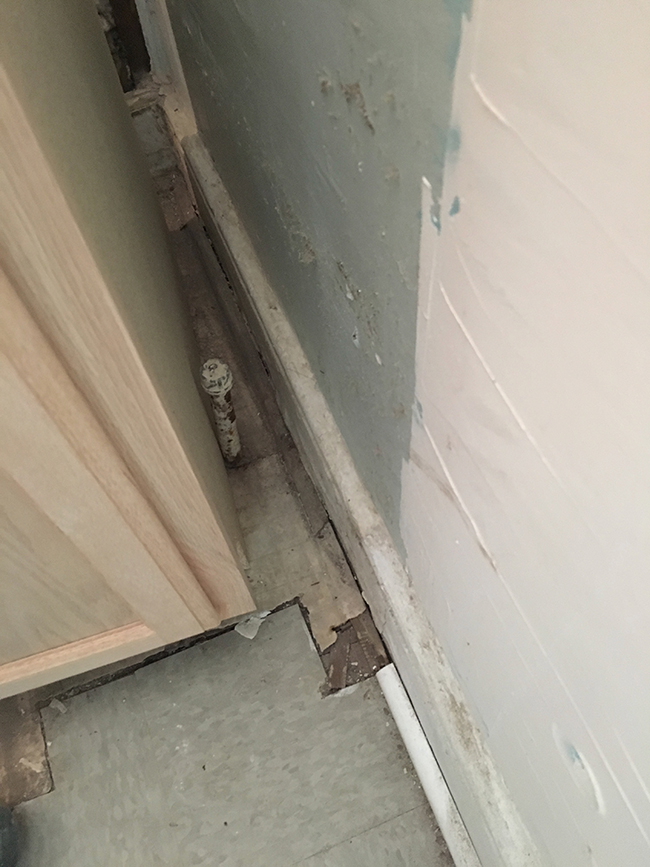
Image resolution: width=650 pixels, height=867 pixels. In order to click on white beam in this screenshot , I will do `click(430, 772)`.